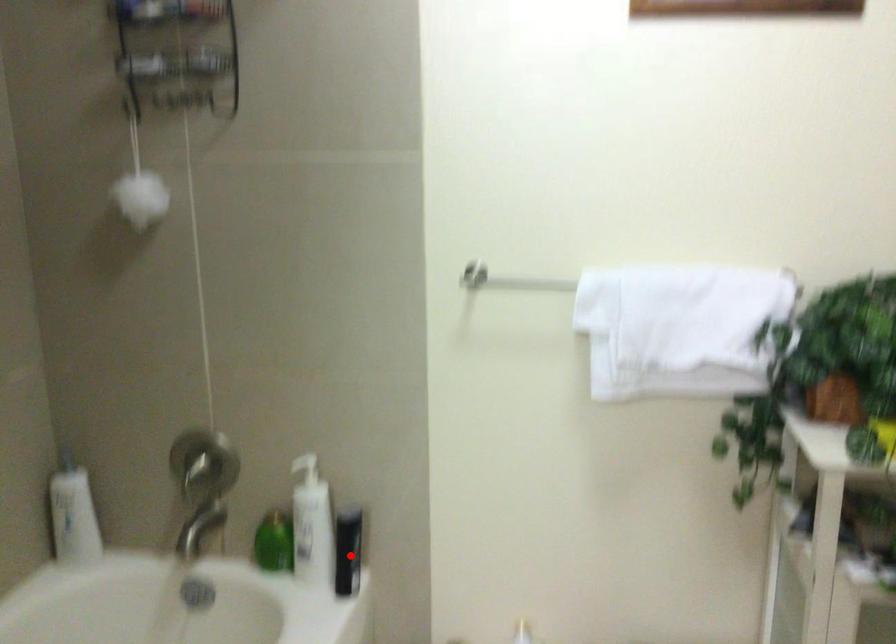
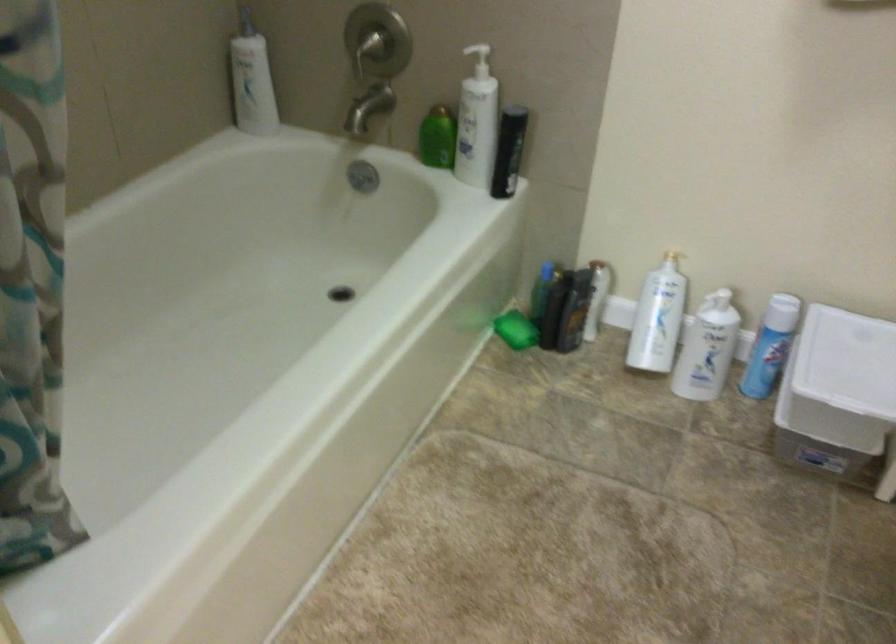
The point at the highlighted location is marked in the first image. Where is the corresponding point in the second image?

(509, 152)